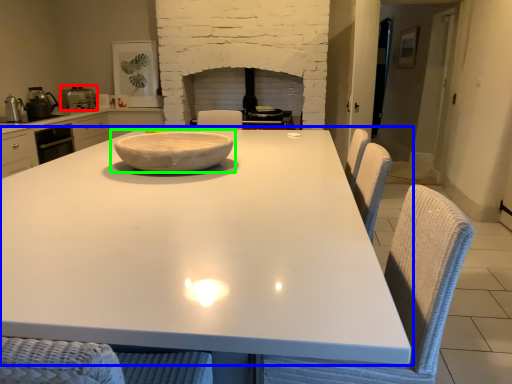
Question: Which object is the closest to the appliance (highlighted by a red box)? Choose among these: table (highlighted by a blue box) or bowl (highlighted by a green box).

Choices:
 (A) table
 (B) bowl

Answer: (B)